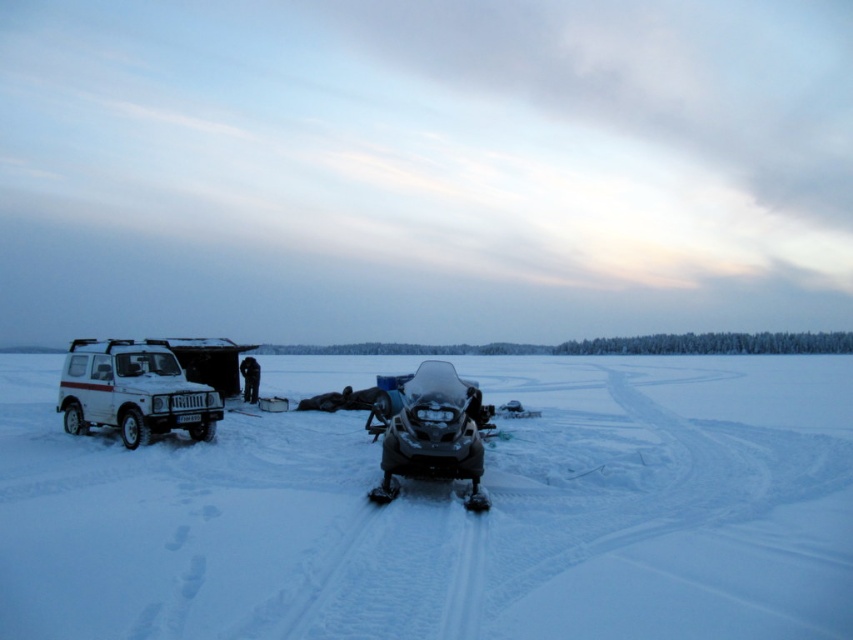
Question: Observing the image, what is the correct spatial positioning of white matte snow at center in reference to white matte jeep at left?

Choices:
 (A) below
 (B) above

Answer: (A)

Question: Which is nearer to the shiny black snowmobile at center?

Choices:
 (A) white matte jeep at left
 (B) white matte snow at center

Answer: (A)

Question: Does white matte snow at center appear on the right side of shiny black snowmobile at center?

Choices:
 (A) no
 (B) yes

Answer: (B)

Question: Which point is closer to the camera?

Choices:
 (A) (213, 426)
 (B) (450, 401)

Answer: (B)

Question: Does white matte jeep at left appear under shiny black snowmobile at center?

Choices:
 (A) yes
 (B) no

Answer: (B)

Question: Which of the following is the closest to the observer?

Choices:
 (A) white matte snow at center
 (B) shiny black snowmobile at center
 (C) white matte jeep at left

Answer: (A)